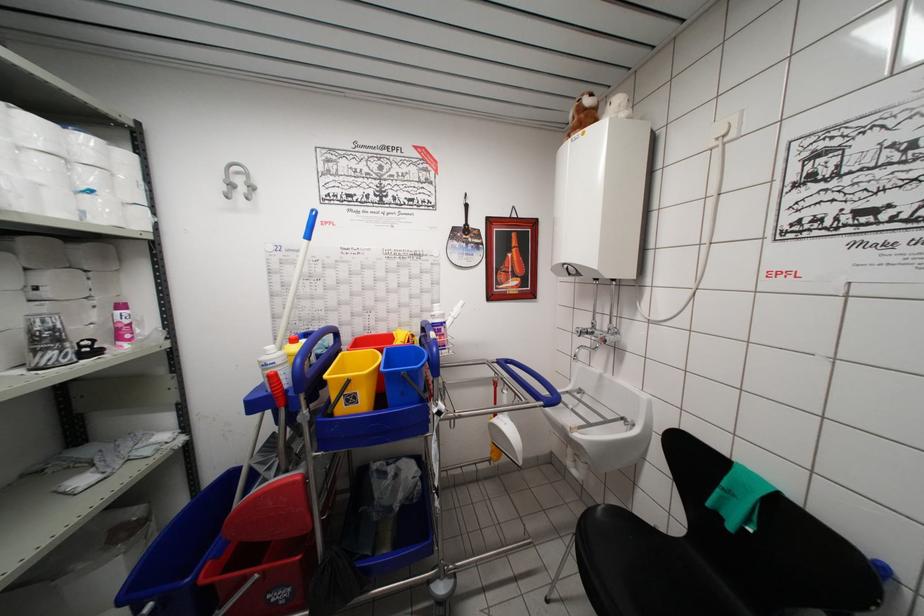
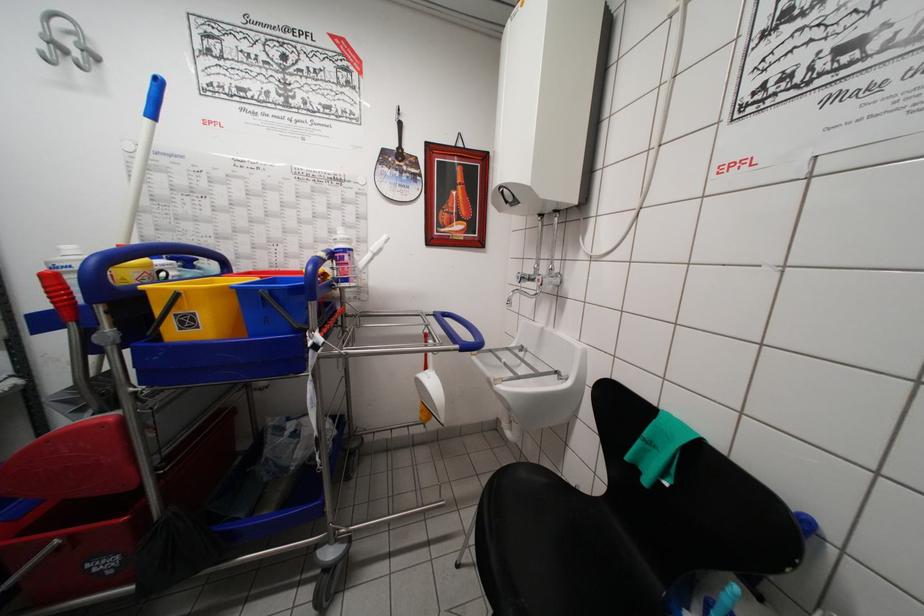
Locate, in the second image, the point that corresponds to point (283, 384) in the first image.

(67, 289)